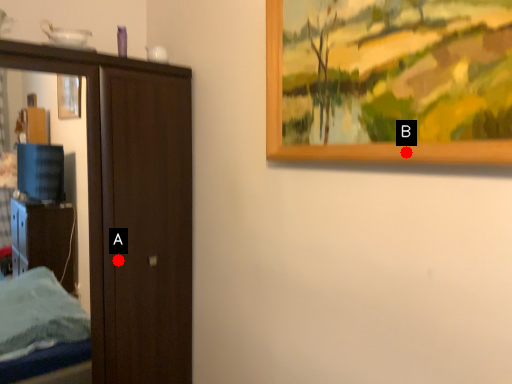
Question: Two points are circled on the image, labeled by A and B beside each circle. Which point is further to the camera?

Choices:
 (A) A is further
 (B) B is further

Answer: (A)